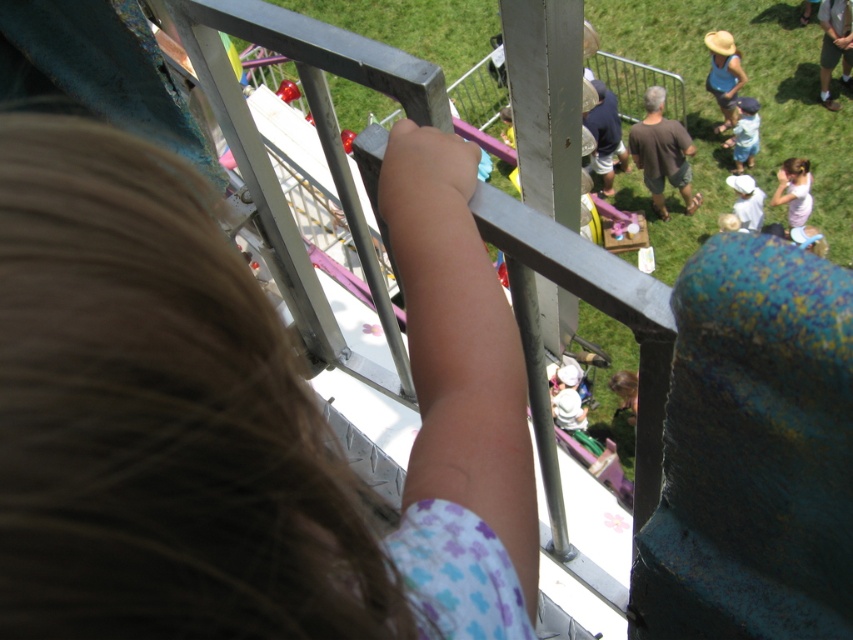
You are standing at point (x=647, y=161) and want to walk to the person holding the railing. Which direction should you move relative to point (x=502, y=516)?

You should move towards point (x=502, y=516) because it is in front of point (x=647, y=161), meaning it is closer to your current position.

You are standing at the center of the fairground. There is a point marked at coordinates [235,416]. What can you see at that point?

At point [235,416] lies blonde hair at upper left.

You are a photographer at the fairground. You want to capture a photo that includes both the blonde hair at upper left and the brown cotton shirt at center. Which object should you focus on first if you want to ensure both are in the frame?

The blonde hair at upper left should be focused on first since it has a smaller width than the brown cotton shirt at center, allowing you to adjust the framing to include both.